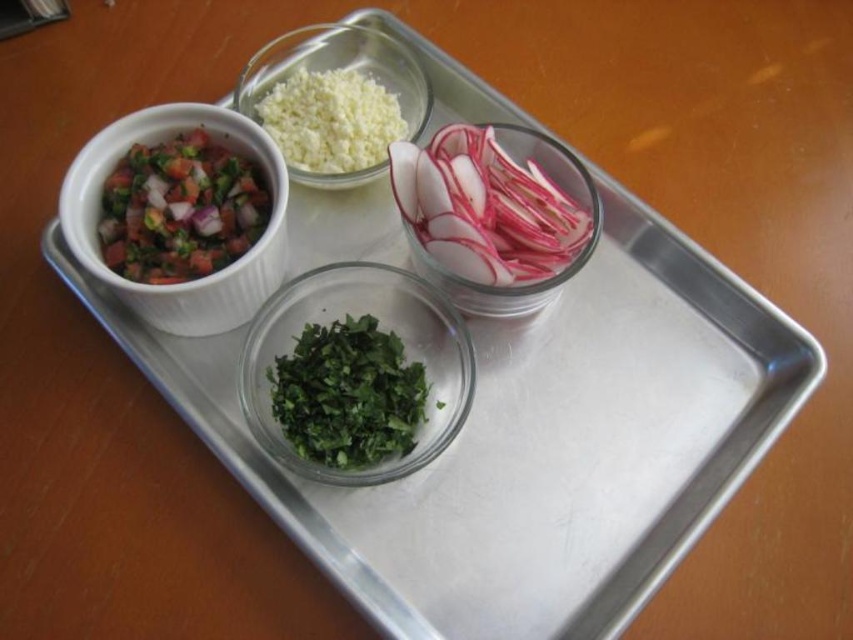
Question: In this image, where is chopped tomato salad at upper left located relative to white ribbed bowl at upper left?

Choices:
 (A) right
 (B) left

Answer: (B)

Question: From the image, what is the correct spatial relationship of pink translucent radish slices at upper right in relation to green leafy herb at center?

Choices:
 (A) above
 (B) below

Answer: (A)

Question: Which object appears farthest from the camera in this image?

Choices:
 (A) green leafy herb at center
 (B) pink translucent radish slices at upper right

Answer: (B)

Question: Which object appears closest to the camera in this image?

Choices:
 (A) pink translucent radish slices at upper right
 (B) white ribbed bowl at upper left
 (C) white translucent bowl at upper center

Answer: (B)

Question: Based on their relative distances, which object is nearer to the green leafy herb at center?

Choices:
 (A) pink translucent radish slices at upper right
 (B) white ribbed bowl at upper left
 (C) chopped tomato salad at upper left
 (D) white translucent bowl at upper center

Answer: (A)

Question: In this image, where is chopped tomato salad at upper left located relative to white translucent bowl at upper center?

Choices:
 (A) below
 (B) above

Answer: (A)